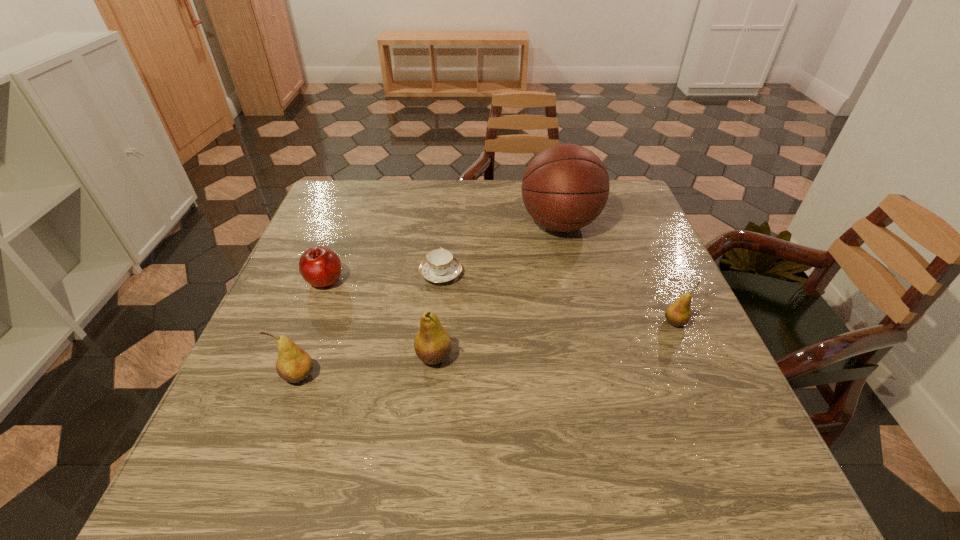
Select which object appears as the fifth closest to the leftmost pear. Please provide its 2D coordinates. Your answer should be formatted as a tuple, i.e. [(x, y)], where the tuple contains the x and y coordinates of a point satisfying the conditions above.

[(678, 313)]

Where is `object that is the third nearest to the teacup`? Image resolution: width=960 pixels, height=540 pixels. object that is the third nearest to the teacup is located at coordinates (321, 267).

What are the coordinates of `pear that is the second closest to the leftmost pear` in the screenshot? It's located at (678, 313).

Identify the location of pear that is the second closest to the leftmost pear. The width and height of the screenshot is (960, 540). (678, 313).

Image resolution: width=960 pixels, height=540 pixels. I want to click on vacant area in the image that satisfies the following two spatial constraints: 1. on the front side of the third nearest object; 2. on the left side of the apple, so click(309, 322).

At what (x,y) coordinates should I click in order to perform the action: click on free space that satisfies the following two spatial constraints: 1. on the side with the handle of the shortest object; 2. on the left side of the tallest object. Please return your answer as a coordinate pair (x, y). The height and width of the screenshot is (540, 960). Looking at the image, I should click on (445, 224).

Locate an element on the screen. The width and height of the screenshot is (960, 540). free spot that satisfies the following two spatial constraints: 1. on the front side of the rightmost object; 2. on the left side of the fifth object from left to right is located at coordinates (583, 322).

Find the location of `free location that satisfies the following two spatial constraints: 1. on the back side of the apple; 2. on the left side of the tallest object`. free location that satisfies the following two spatial constraints: 1. on the back side of the apple; 2. on the left side of the tallest object is located at coordinates (347, 224).

I want to click on free location that satisfies the following two spatial constraints: 1. on the front side of the second pear from left to right; 2. on the left side of the apple, so click(296, 356).

At what (x,y) coordinates should I click in order to perform the action: click on free spot that satisfies the following two spatial constraints: 1. on the side with the handle of the shortest object; 2. on the left side of the tallest object. Please return your answer as a coordinate pair (x, y). Looking at the image, I should click on pyautogui.click(x=445, y=224).